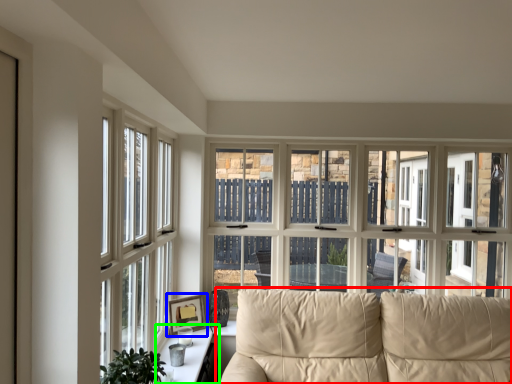
Question: Estimate the real-world distances between objects in this image. Which object is closer to studio couch (highlighted by a red box), picture frame (highlighted by a blue box) or table (highlighted by a green box)?

Choices:
 (A) picture frame
 (B) table

Answer: (B)